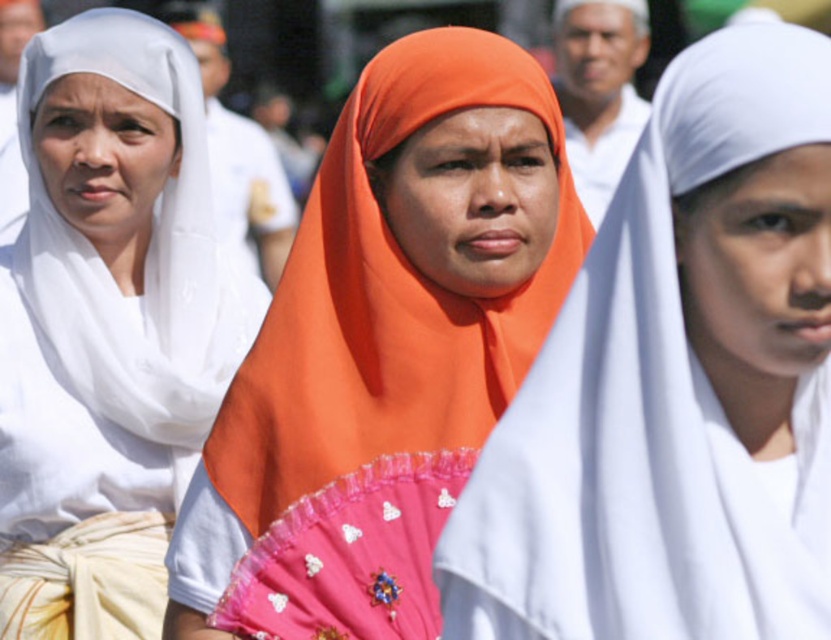
Question: In this image, where is orange fabric headscarf at center located relative to white matte scarf at left?

Choices:
 (A) right
 (B) left

Answer: (A)

Question: Can you confirm if orange fabric headscarf at center is positioned to the right of white matte scarf at left?

Choices:
 (A) yes
 (B) no

Answer: (A)

Question: Which object is closer to the camera taking this photo?

Choices:
 (A) orange fabric headscarf at center
 (B) white matte veil at center
 (C) white matte scarf at left

Answer: (B)

Question: Which point appears farthest from the camera in this image?

Choices:
 (A) (332, 275)
 (B) (153, 134)

Answer: (B)

Question: Which point is farther from the camera taking this photo?

Choices:
 (A) (774, 532)
 (B) (97, 280)
 (C) (421, 177)

Answer: (B)

Question: Can you confirm if white matte veil at center is wider than white matte scarf at left?

Choices:
 (A) yes
 (B) no

Answer: (B)